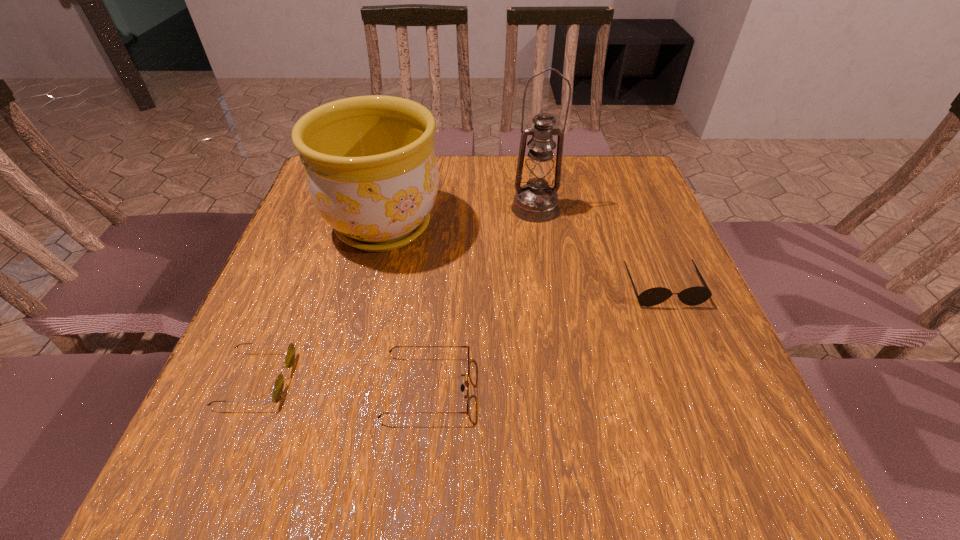
At what (x,y) coordinates should I click in order to perform the action: click on the tallest object. Please return your answer as a coordinate pair (x, y). The image size is (960, 540). Looking at the image, I should click on (536, 202).

Where is `the second object from right to left`? the second object from right to left is located at coordinates (536, 202).

Find the location of a particular element. The width and height of the screenshot is (960, 540). flowerpot is located at coordinates (370, 166).

Where is `the third nearest object`? The image size is (960, 540). the third nearest object is located at coordinates (692, 296).

Identify the location of the third shortest object. (692, 296).

At what (x,y) coordinates should I click in order to perform the action: click on the second sunglasses from left to right. Please return your answer as a coordinate pair (x, y). The width and height of the screenshot is (960, 540). Looking at the image, I should click on (462, 387).

What are the coordinates of `the leftmost sunglasses` in the screenshot? It's located at (277, 392).

You are a GUI agent. You are given a task and a screenshot of the screen. Output one action in this format:
    pyautogui.click(x=<x>, y=<y>)
    Task: Click on the vacant point located on the left of the oil lamp
    
    Given the screenshot: What is the action you would take?
    pyautogui.click(x=465, y=208)

This screenshot has height=540, width=960. What are the coordinates of `free space located on the right of the flowerpot` in the screenshot? It's located at (484, 226).

Find the location of a particular element. Image resolution: width=960 pixels, height=540 pixels. vacant space located 0.150m on the front-facing side of the farthest sunglasses is located at coordinates (696, 371).